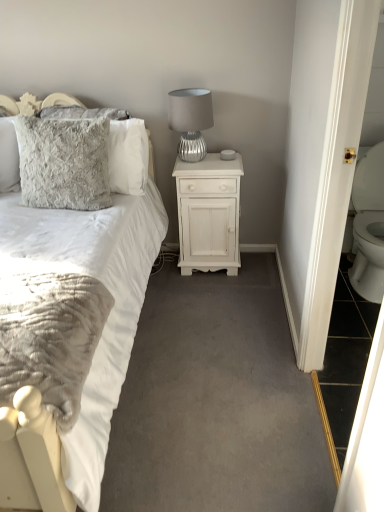
Question: Should I look upward or downward to see fluffy gray pillow at upper left, positioned as the 1th pillow in back-to-front order?

Choices:
 (A) down
 (B) up

Answer: (B)

Question: Considering the relative sizes of white soft fabric bed at left and silver textured lamp at upper right in the image provided, is white soft fabric bed at left wider than silver textured lamp at upper right?

Choices:
 (A) yes
 (B) no

Answer: (A)

Question: From the image's perspective, is white soft fabric bed at left under silver textured lamp at upper right?

Choices:
 (A) no
 (B) yes

Answer: (B)

Question: Is white soft fabric bed at left outside of silver textured lamp at upper right?

Choices:
 (A) yes
 (B) no

Answer: (A)

Question: Is white soft fabric bed at left oriented towards silver textured lamp at upper right?

Choices:
 (A) yes
 (B) no

Answer: (B)

Question: From the image's perspective, is white soft fabric bed at left over silver textured lamp at upper right?

Choices:
 (A) yes
 (B) no

Answer: (B)

Question: Is white soft fabric bed at left shorter than silver textured lamp at upper right?

Choices:
 (A) no
 (B) yes

Answer: (A)

Question: Can you confirm if silver textured lamp at upper right is positioned to the left of fluffy gray pillow at upper left, positioned as the 1th pillow in back-to-front order?

Choices:
 (A) no
 (B) yes

Answer: (A)

Question: Considering the relative sizes of silver textured lamp at upper right and fluffy gray pillow at upper left, positioned as the 1th pillow in back-to-front order, in the image provided, is silver textured lamp at upper right thinner than fluffy gray pillow at upper left, positioned as the 1th pillow in back-to-front order,?

Choices:
 (A) yes
 (B) no

Answer: (B)

Question: Does silver textured lamp at upper right appear on the right side of fluffy gray pillow at upper left, positioned as the 1th pillow in back-to-front order?

Choices:
 (A) yes
 (B) no

Answer: (A)

Question: Can you confirm if silver textured lamp at upper right is shorter than fluffy gray pillow at upper left, positioned as the 1th pillow in back-to-front order?

Choices:
 (A) yes
 (B) no

Answer: (A)

Question: Is silver textured lamp at upper right oriented away from fluffy gray pillow at upper left, positioned as the 1th pillow in back-to-front order?

Choices:
 (A) no
 (B) yes

Answer: (A)

Question: From a real-world perspective, is silver textured lamp at upper right over fluffy gray pillow at upper left, which is counted as the 2th pillow, starting from the front?

Choices:
 (A) no
 (B) yes

Answer: (B)

Question: Considering the relative positions of fluffy gray pillow at upper left, positioned as the 1th pillow in back-to-front order, and white soft fabric bed at left in the image provided, is fluffy gray pillow at upper left, positioned as the 1th pillow in back-to-front order, in front of white soft fabric bed at left?

Choices:
 (A) yes
 (B) no

Answer: (B)